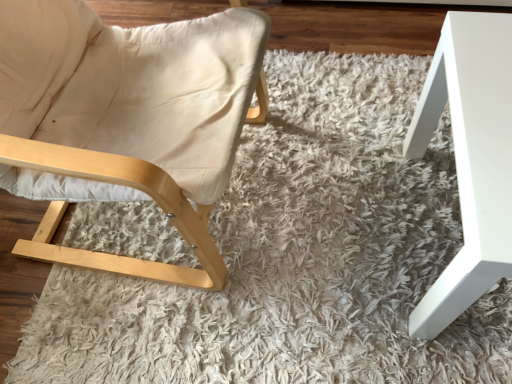
Describe the element at coordinates (470, 158) in the screenshot. The height and width of the screenshot is (384, 512). I see `white glossy table at right` at that location.

You are a GUI agent. You are given a task and a screenshot of the screen. Output one action in this format:
    pyautogui.click(x=<x>, y=<y>)
    Task: Click on the white glossy table at right
    
    Given the screenshot: What is the action you would take?
    pyautogui.click(x=470, y=158)

Measure the distance between beige fabric chair at left and camera.

beige fabric chair at left and camera are 68.58 centimeters apart.

I want to click on beige fabric chair at left, so click(x=126, y=120).

Image resolution: width=512 pixels, height=384 pixels. What do you see at coordinates (126, 120) in the screenshot?
I see `beige fabric chair at left` at bounding box center [126, 120].

Locate an element on the screen. The width and height of the screenshot is (512, 384). white glossy table at right is located at coordinates (470, 158).

Is white glossy table at right to the right of beige fabric chair at left from the viewer's perspective?

Correct, you'll find white glossy table at right to the right of beige fabric chair at left.

Which object is more forward, white glossy table at right or beige fabric chair at left?

beige fabric chair at left is closer to the camera.

Which is in front, point (443, 61) or point (8, 79)?

The point (443, 61) is closer to the camera.

From the image's perspective, is white glossy table at right over beige fabric chair at left?

No, from the image's perspective, white glossy table at right is not over beige fabric chair at left.

From a real-world perspective, which is physically below, white glossy table at right or beige fabric chair at left?

white glossy table at right.

Which of these two, white glossy table at right or beige fabric chair at left, is wider?

beige fabric chair at left is wider.

From their relative heights in the image, would you say white glossy table at right is taller or shorter than beige fabric chair at left?

Clearly, white glossy table at right is shorter compared to beige fabric chair at left.

Is white glossy table at right smaller than beige fabric chair at left?

Indeed, white glossy table at right has a smaller size compared to beige fabric chair at left.

Is white glossy table at right situated inside beige fabric chair at left or outside?

white glossy table at right is not inside beige fabric chair at left, it's outside.

Does white glossy table at right touch beige fabric chair at left?

No, white glossy table at right is not in contact with beige fabric chair at left.

Is white glossy table at right facing towards beige fabric chair at left?

No, white glossy table at right is not aimed at beige fabric chair at left.

The width and height of the screenshot is (512, 384). Find the location of `table behind the beige fabric chair at left`. table behind the beige fabric chair at left is located at coordinates (470, 158).

Does beige fabric chair at left appear on the left side of white glossy table at right?

Yes, beige fabric chair at left is to the left of white glossy table at right.

Which object is further away from the camera taking this photo, beige fabric chair at left or white glossy table at right?

white glossy table at right is behind.

Does point (196, 137) come farther from viewer compared to point (493, 159)?

Yes, it is behind point (493, 159).

From the image's perspective, is beige fabric chair at left on top of white glossy table at right?

Yes, from the image's perspective, beige fabric chair at left is above white glossy table at right.

From a real-world perspective, is beige fabric chair at left located beneath white glossy table at right?

No, from a real-world perspective, beige fabric chair at left is not below white glossy table at right.

Between beige fabric chair at left and white glossy table at right, which one has smaller width?

With smaller width is white glossy table at right.

Is beige fabric chair at left taller than white glossy table at right?

Yes.

Can you confirm if beige fabric chair at left is smaller than white glossy table at right?

No, beige fabric chair at left is not smaller than white glossy table at right.

Can we say beige fabric chair at left lies outside white glossy table at right?

Indeed, beige fabric chair at left is completely outside white glossy table at right.

Would you consider beige fabric chair at left to be distant from white glossy table at right?

No, beige fabric chair at left is not far away from white glossy table at right.

From the picture: Is beige fabric chair at left facing away from white glossy table at right?

That's not correct — beige fabric chair at left is not looking away from white glossy table at right.

How many degrees apart are the facing directions of beige fabric chair at left and white glossy table at right?

beige fabric chair at left and white glossy table at right are facing 86.2 degrees away from each other.

Image resolution: width=512 pixels, height=384 pixels. Find the location of `table to the right of beige fabric chair at left`. table to the right of beige fabric chair at left is located at coordinates (470, 158).

Find the location of `table on the right of beige fabric chair at left`. table on the right of beige fabric chair at left is located at coordinates (470, 158).

Find the location of a particular element. The height and width of the screenshot is (384, 512). chair in front of the white glossy table at right is located at coordinates (126, 120).